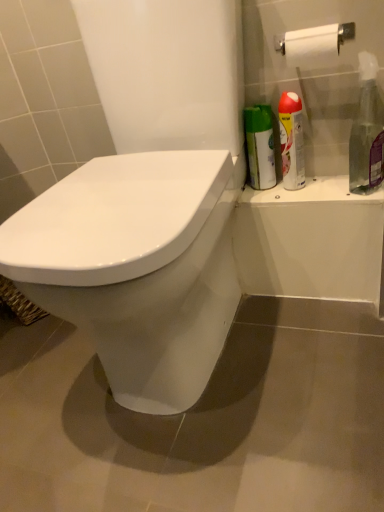
Question: Does white glossy toilet at center have a greater width compared to silver metallic spray can at upper right, the 2th cleaning product in the right-to-left sequence?

Choices:
 (A) no
 (B) yes

Answer: (B)

Question: Is white glossy toilet at center closer to camera compared to silver metallic spray can at upper right, which is the 1th cleaning product from left to right?

Choices:
 (A) yes
 (B) no

Answer: (A)

Question: Does white glossy toilet at center have a lesser height compared to silver metallic spray can at upper right, the 2th cleaning product in the right-to-left sequence?

Choices:
 (A) yes
 (B) no

Answer: (B)

Question: Considering the relative sizes of white glossy toilet at center and silver metallic spray can at upper right, the 2th cleaning product in the right-to-left sequence, in the image provided, is white glossy toilet at center bigger than silver metallic spray can at upper right, the 2th cleaning product in the right-to-left sequence,?

Choices:
 (A) no
 (B) yes

Answer: (B)

Question: Can you confirm if white glossy toilet at center is taller than silver metallic spray can at upper right, the 2th cleaning product in the right-to-left sequence?

Choices:
 (A) yes
 (B) no

Answer: (A)

Question: Is white glossy toilet at center smaller than silver metallic spray can at upper right, which is the 1th cleaning product from left to right?

Choices:
 (A) no
 (B) yes

Answer: (A)

Question: Considering the relative positions of white glossy toilet at center and clear plastic spray bottle at right, marked as the 2th cleaning product in a left-to-right arrangement, in the image provided, is white glossy toilet at center in front of clear plastic spray bottle at right, marked as the 2th cleaning product in a left-to-right arrangement,?

Choices:
 (A) no
 (B) yes

Answer: (B)

Question: From the image's perspective, is white glossy toilet at center beneath clear plastic spray bottle at right, the first cleaning product from the right?

Choices:
 (A) no
 (B) yes

Answer: (B)

Question: Is white glossy toilet at center bigger than clear plastic spray bottle at right, marked as the 2th cleaning product in a left-to-right arrangement?

Choices:
 (A) no
 (B) yes

Answer: (B)

Question: Is white glossy toilet at center far from clear plastic spray bottle at right, the first cleaning product from the right?

Choices:
 (A) no
 (B) yes

Answer: (A)

Question: Is white glossy toilet at center to the left of clear plastic spray bottle at right, the first cleaning product from the right, from the viewer's perspective?

Choices:
 (A) yes
 (B) no

Answer: (A)

Question: Does white glossy toilet at center have a lesser height compared to clear plastic spray bottle at right, the first cleaning product from the right?

Choices:
 (A) no
 (B) yes

Answer: (A)

Question: Is silver metallic spray can at upper right, which is the 1th cleaning product from left to right, positioned with its back to white glossy toilet at center?

Choices:
 (A) no
 (B) yes

Answer: (A)